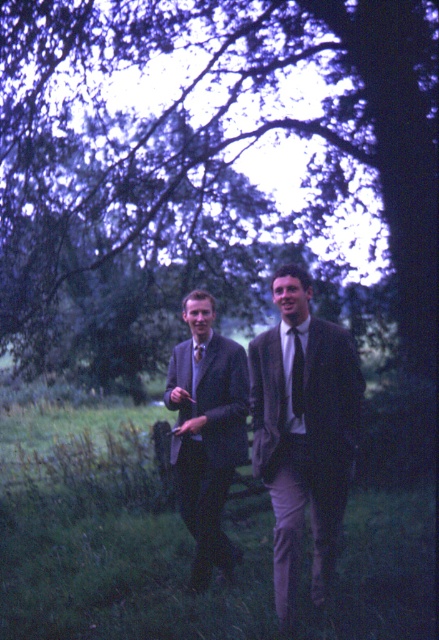
Is matte brown tie at center taller than purple satin tie at center?

Yes.

Is point (298, 387) more distant than point (194, 349)?

No.

The width and height of the screenshot is (439, 640). I want to click on matte brown tie at center, so click(x=297, y=376).

Does green leafy tree at upper center appear on the right side of purple satin tie at center?

In fact, green leafy tree at upper center is to the left of purple satin tie at center.

At what (x,y) coordinates should I click in order to perform the action: click on green leafy tree at upper center. Please return your answer as a coordinate pair (x, y). Looking at the image, I should click on (209, 170).

Does matte black suit at center have a lesser width compared to matte brown tie at center?

Incorrect, matte black suit at center's width is not less than matte brown tie at center's.

Can you confirm if matte black suit at center is positioned to the left of matte brown tie at center?

Indeed, matte black suit at center is positioned on the left side of matte brown tie at center.

Does point (207, 483) come farther from viewer compared to point (298, 371)?

Yes, point (207, 483) is farther from viewer.

At what (x,y) coordinates should I click in order to perform the action: click on matte black suit at center. Please return your answer as a coordinate pair (x, y). Image resolution: width=439 pixels, height=640 pixels. Looking at the image, I should click on coord(207,432).